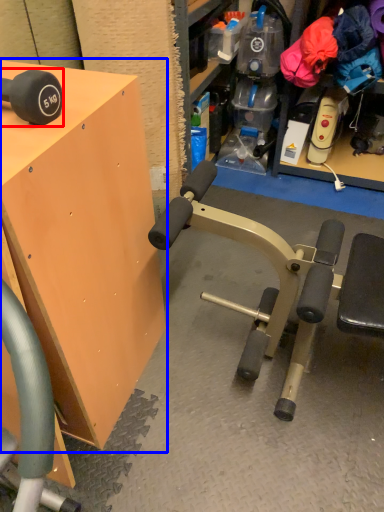
Question: Among these objects, which one is nearest to the camera, dumbbell (highlighted by a red box) or table (highlighted by a blue box)?

Choices:
 (A) dumbbell
 (B) table

Answer: (B)